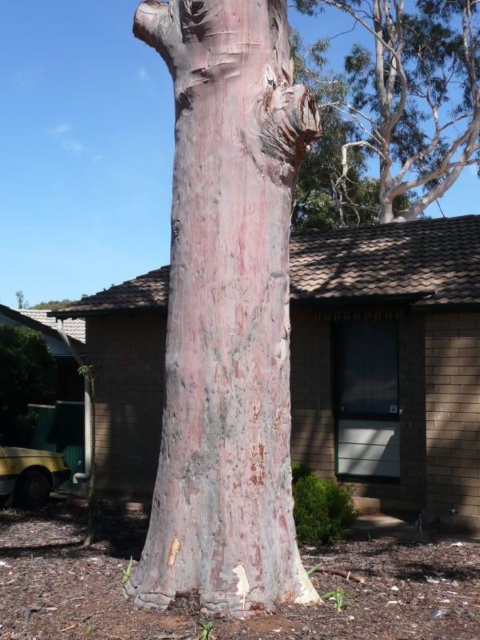
You are standing in a forest and want to take a photo of both the speckled bark tree trunk at center and the smooth bark tree trunk at upper center. Which tree trunk should you focus on first to ensure both are in clear view?

You should focus on the speckled bark tree trunk at center first because it is closer to you than the smooth bark tree trunk at upper center, so adjusting focus from near to far will help capture both clearly.

You are standing in front of the tree trunk and want to locate the smooth bark tree trunk at upper center. According to the coordinates provided, where should you look relative to the center of the image?

The smooth bark tree trunk at upper center is located at coordinates point 0.148 on the x axis and 0.863 on the y axis, so you should look slightly to the left and mostly upwards from the center of the image.

You are a gardener assessing the space between the speckled bark tree trunk at center and the green matte bush at lower left. Which object is taller?

The speckled bark tree trunk at center is taller than the green matte bush at lower left.